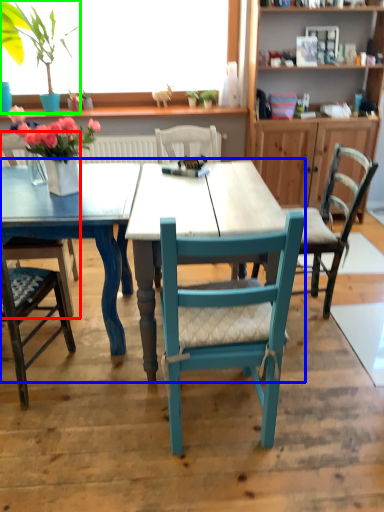
Question: Considering the real-world distances, which object is closest to chair (highlighted by a red box)? kitchen & dining room table (highlighted by a blue box) or houseplant (highlighted by a green box).

Choices:
 (A) kitchen & dining room table
 (B) houseplant

Answer: (A)